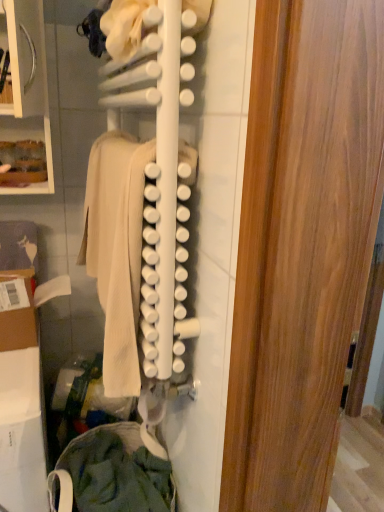
Question: Should I look upward or downward to see green cotton pants at lower left, the first clothing ordered from the bottom?

Choices:
 (A) up
 (B) down

Answer: (B)

Question: Considering the relative sizes of green cotton pants at lower left, the second clothing from the top, and beige wool sweater at center, the 1th clothing positioned from the top, in the image provided, is green cotton pants at lower left, the second clothing from the top, bigger than beige wool sweater at center, the 1th clothing positioned from the top,?

Choices:
 (A) no
 (B) yes

Answer: (B)

Question: Is green cotton pants at lower left, the first clothing ordered from the bottom, smaller than beige wool sweater at center, which ranks as the second clothing in bottom-to-top order?

Choices:
 (A) yes
 (B) no

Answer: (B)

Question: Is green cotton pants at lower left, the second clothing from the top, facing towards beige wool sweater at center, which ranks as the second clothing in bottom-to-top order?

Choices:
 (A) no
 (B) yes

Answer: (A)

Question: Can you confirm if green cotton pants at lower left, the second clothing from the top, is positioned to the right of beige wool sweater at center, which ranks as the second clothing in bottom-to-top order?

Choices:
 (A) yes
 (B) no

Answer: (B)

Question: From a real-world perspective, is green cotton pants at lower left, the first clothing ordered from the bottom, positioned under beige wool sweater at center, which ranks as the second clothing in bottom-to-top order, based on gravity?

Choices:
 (A) no
 (B) yes

Answer: (B)

Question: Is beige wool sweater at center, the 1th clothing positioned from the top, at the back of green cotton pants at lower left, the first clothing ordered from the bottom?

Choices:
 (A) no
 (B) yes

Answer: (A)

Question: Is green cotton pants at lower left, the second clothing from the top, behind white matte rack at center?

Choices:
 (A) yes
 (B) no

Answer: (A)

Question: From the image's perspective, is green cotton pants at lower left, the first clothing ordered from the bottom, below white matte rack at center?

Choices:
 (A) no
 (B) yes

Answer: (B)

Question: Can you confirm if green cotton pants at lower left, the first clothing ordered from the bottom, is shorter than white matte rack at center?

Choices:
 (A) yes
 (B) no

Answer: (A)

Question: Would you consider green cotton pants at lower left, the second clothing from the top, to be distant from white matte rack at center?

Choices:
 (A) no
 (B) yes

Answer: (A)

Question: From a real-world perspective, is green cotton pants at lower left, the second clothing from the top, below white matte rack at center?

Choices:
 (A) yes
 (B) no

Answer: (A)

Question: Is green cotton pants at lower left, the second clothing from the top, in front of white matte rack at center?

Choices:
 (A) no
 (B) yes

Answer: (A)

Question: Does white matte rack at center appear on the left side of green cotton pants at lower left, the second clothing from the top?

Choices:
 (A) no
 (B) yes

Answer: (A)